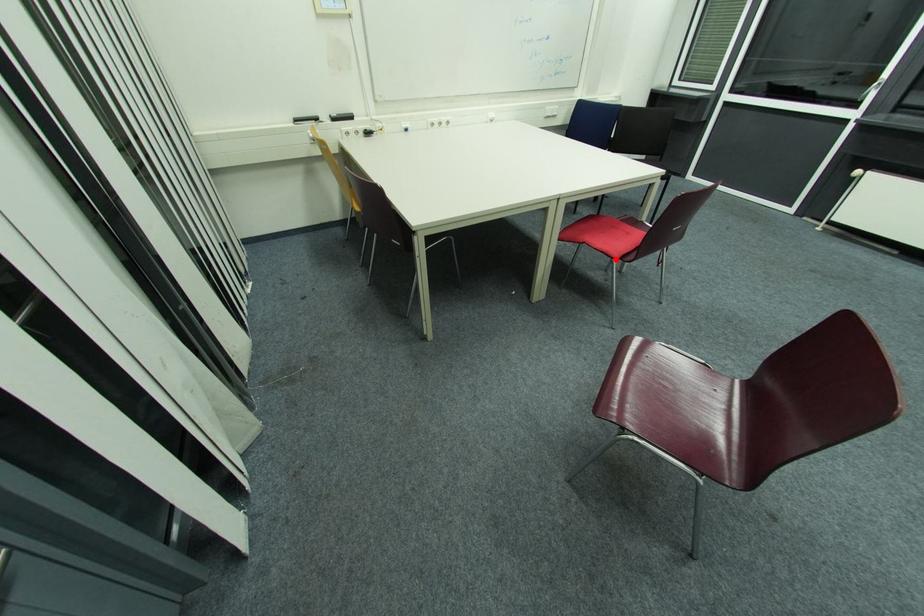
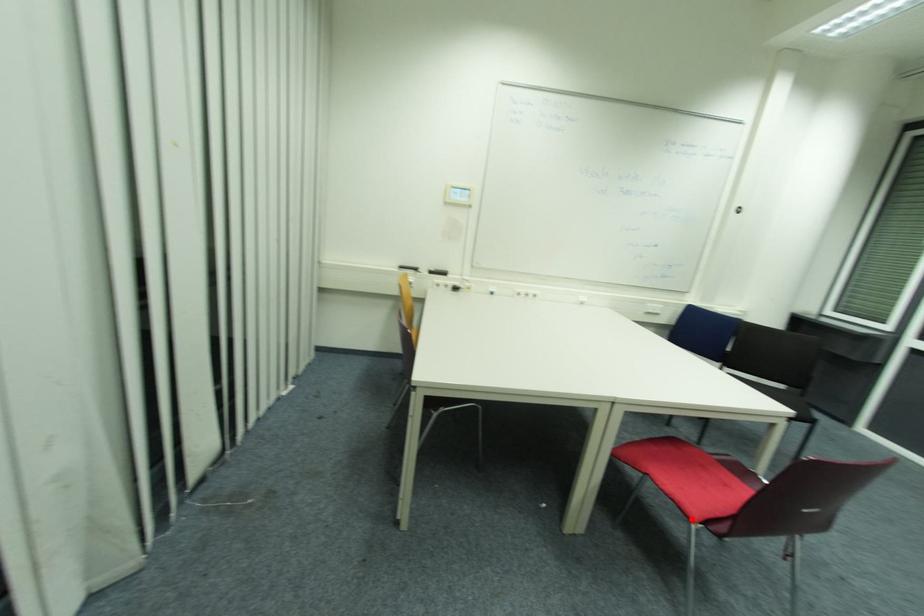
I am providing you with two images of the same scene from different viewpoints. A red point is marked on the first image and another point is marked on the second image. Are the points marked in image1 and image2 representing the same 3D position?

Yes